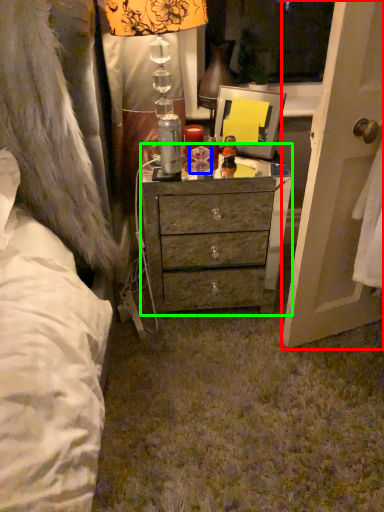
Question: Estimate the real-world distances between objects in this image. Which object is closer to screen door (highlighted by a red box), toy (highlighted by a blue box) or desk (highlighted by a green box)?

Choices:
 (A) toy
 (B) desk

Answer: (B)